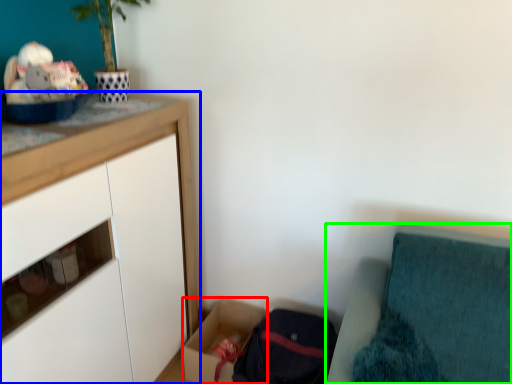
Question: Which is nearer to the storage box (highlighted by a red box)? cabinetry (highlighted by a blue box) or furniture (highlighted by a green box).

Choices:
 (A) cabinetry
 (B) furniture

Answer: (A)